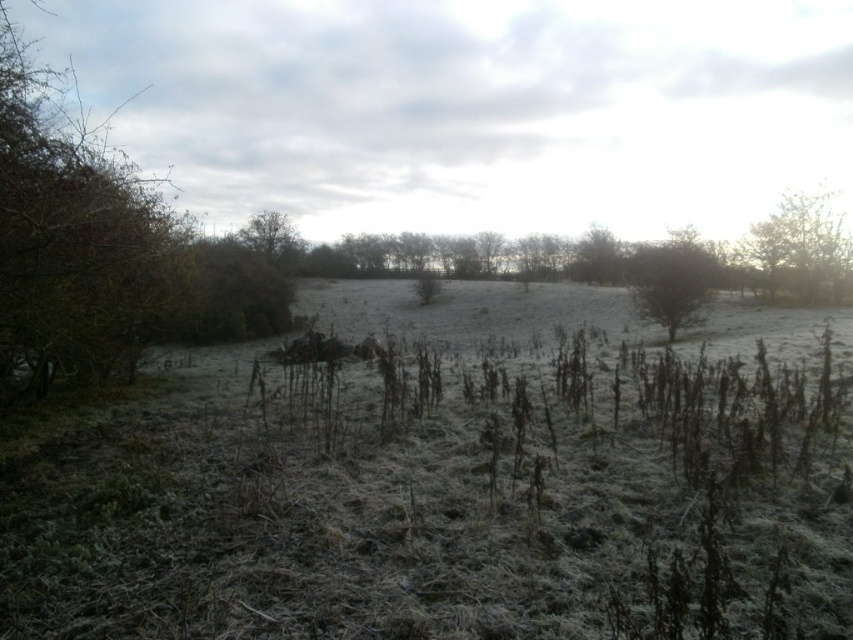
Question: Which point appears closest to the camera in this image?

Choices:
 (A) (608, 259)
 (B) (691, 230)
 (C) (833, 285)

Answer: (C)

Question: Is brown textured tree at right further to the viewer compared to brown textured tree at center?

Choices:
 (A) yes
 (B) no

Answer: (B)

Question: Which object is farther from the camera taking this photo?

Choices:
 (A) green matte tree at upper right
 (B) brown textured bush at left
 (C) brown textured tree at right

Answer: (C)

Question: Does brown textured bush at left have a larger size compared to brown textured tree at right?

Choices:
 (A) no
 (B) yes

Answer: (B)

Question: Can you confirm if brown textured bush at left is wider than green matte tree at upper right?

Choices:
 (A) yes
 (B) no

Answer: (A)

Question: Among these objects, which one is farthest from the camera?

Choices:
 (A) green matte tree at upper right
 (B) brown textured tree at center
 (C) brown textured bush at left
 (D) brown textured tree at right

Answer: (B)